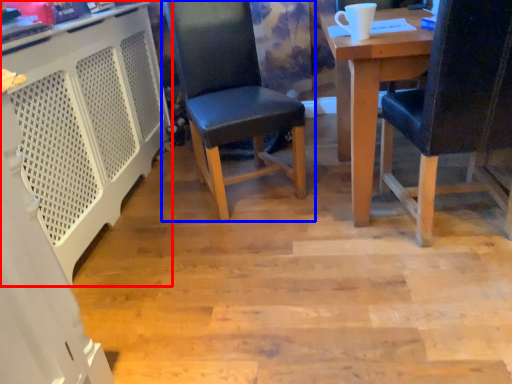
Question: Which object appears closest to the camera in this image, computer desk (highlighted by a red box) or chair (highlighted by a blue box)?

Choices:
 (A) computer desk
 (B) chair

Answer: (A)